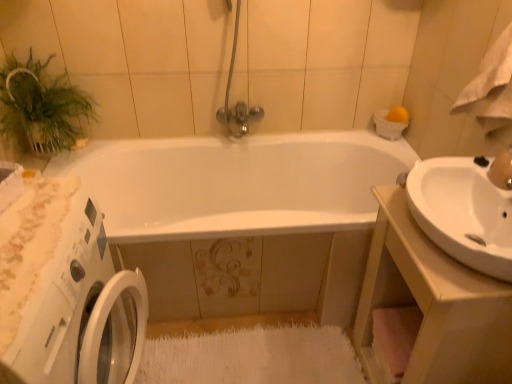
The width and height of the screenshot is (512, 384). I want to click on free spot above white glossy sink at right (from a real-world perspective), so click(446, 229).